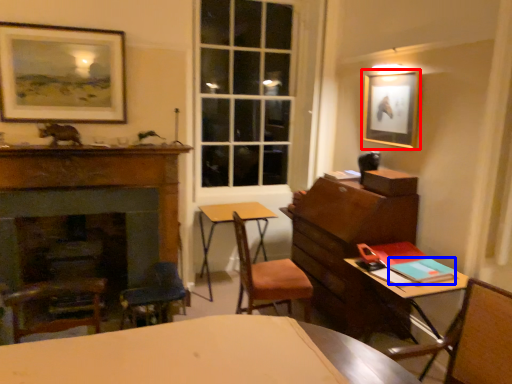
Question: Which of the following is the farthest to the observer, picture frame (highlighted by a red box) or book (highlighted by a blue box)?

Choices:
 (A) picture frame
 (B) book

Answer: (A)